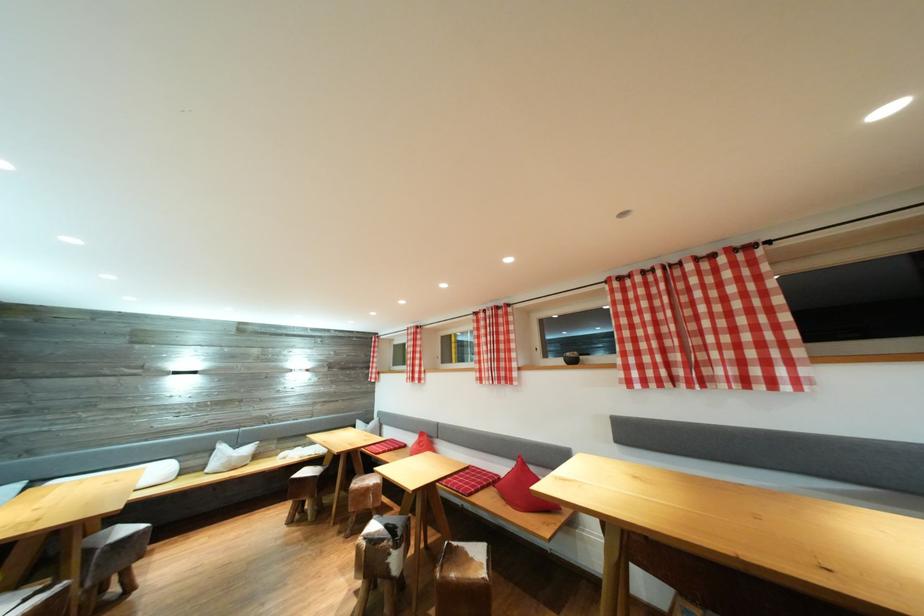
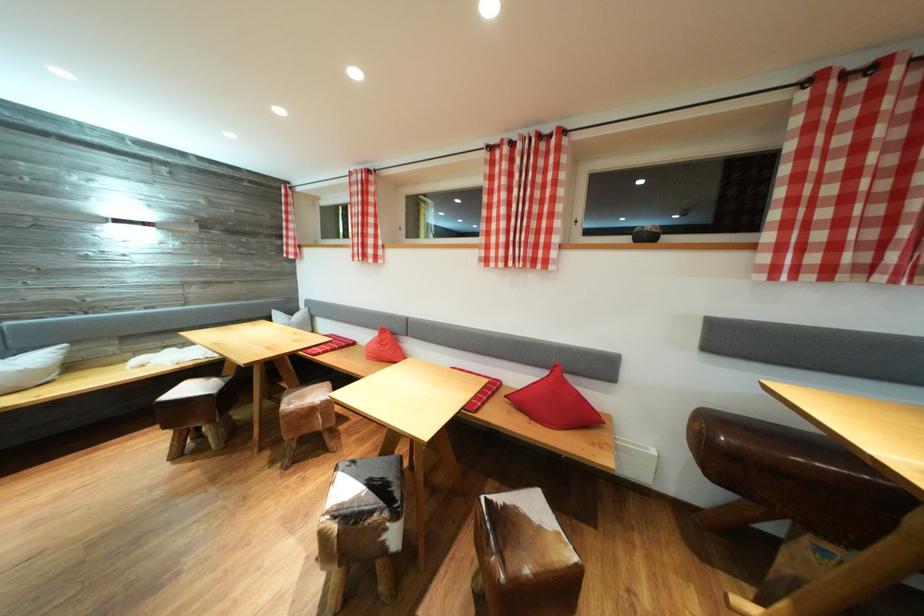
The images are taken continuously from a first-person perspective. In which direction are you moving?

The cameraman moved toward left, forward.